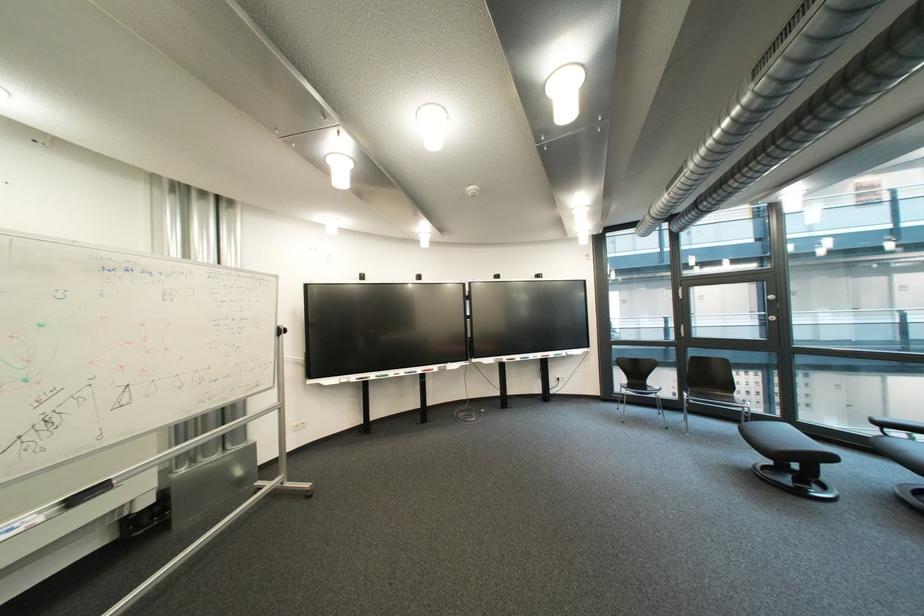
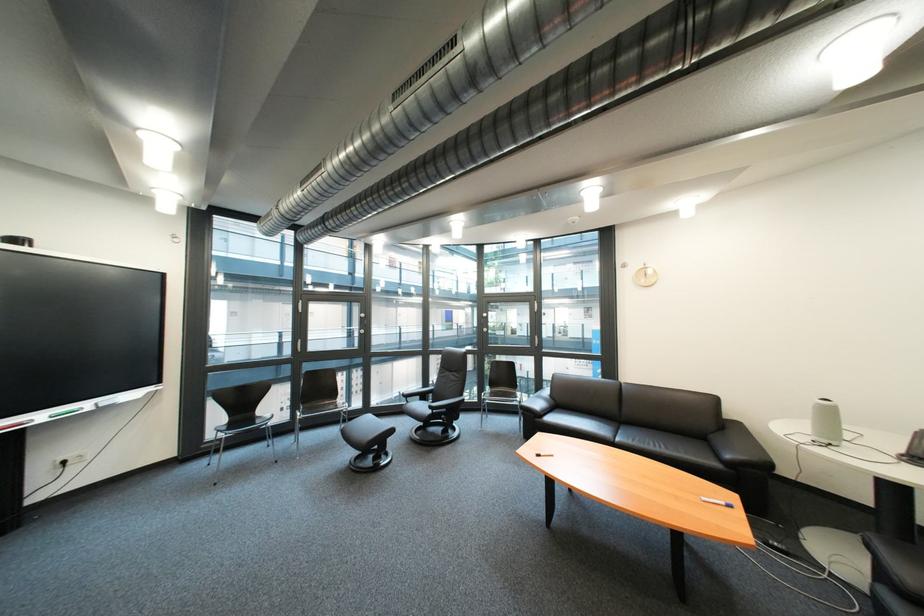
In the second image, find the point that corresponds to [642,387] in the first image.

(246, 426)